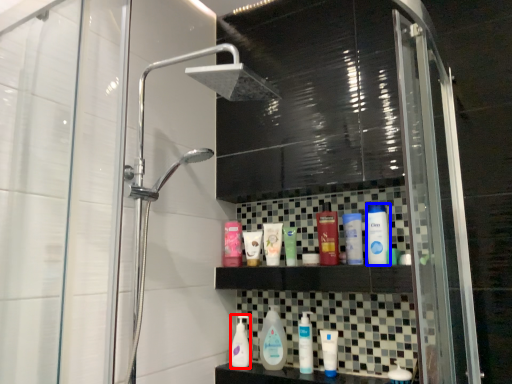
Question: Which object is closer to the camera taking this photo, cleaning product (highlighted by a red box) or toiletry (highlighted by a blue box)?

Choices:
 (A) cleaning product
 (B) toiletry

Answer: (B)